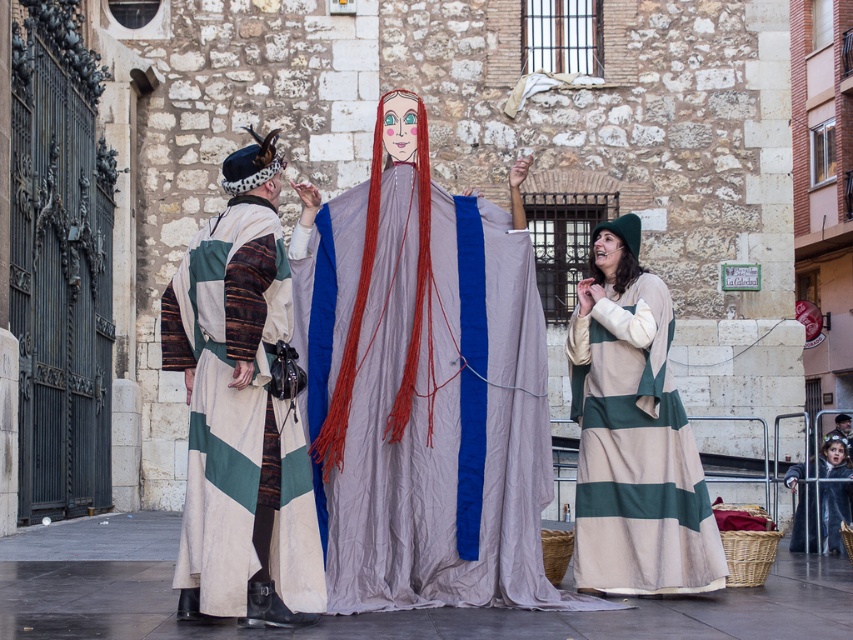
Question: Which point is closer to the camera taking this photo?

Choices:
 (A) (831, 547)
 (B) (195, 337)

Answer: (B)

Question: Based on their relative distances, which object is farther from the velvet black robe at lower right?

Choices:
 (A) multicolored woven robe at center
 (B) green striped fabric dress at lower right

Answer: (A)

Question: Is matte gray fabric at center to the right of multicolored woven robe at center from the viewer's perspective?

Choices:
 (A) yes
 (B) no

Answer: (A)

Question: Which point is farther to the camera?

Choices:
 (A) matte gray fabric at center
 (B) multicolored woven robe at center
 (C) velvet black robe at lower right
 (D) green striped fabric dress at lower right

Answer: (C)

Question: Does multicolored woven robe at center have a smaller size compared to green striped fabric dress at lower right?

Choices:
 (A) no
 (B) yes

Answer: (B)

Question: Observing the image, what is the correct spatial positioning of matte gray fabric at center in reference to velvet black robe at lower right?

Choices:
 (A) above
 (B) below

Answer: (A)